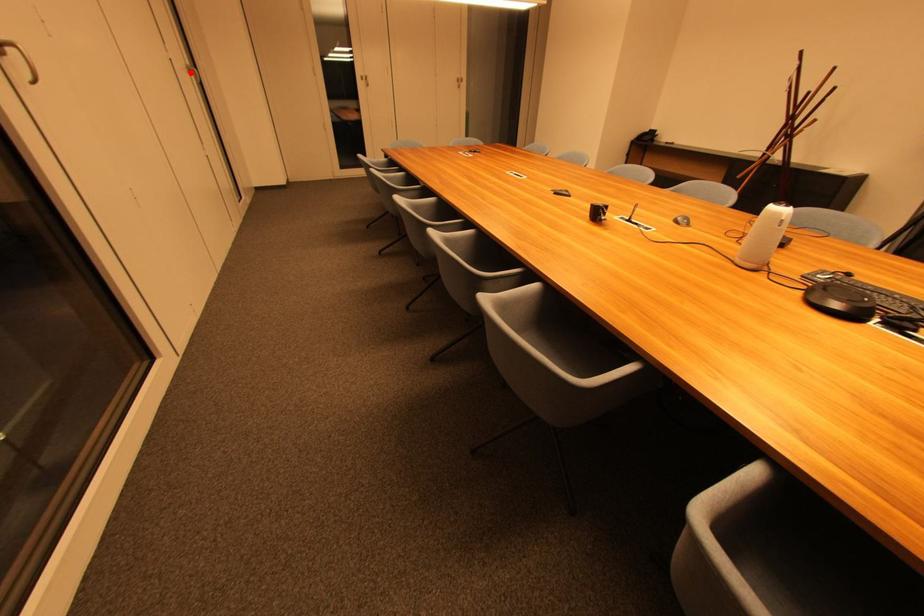
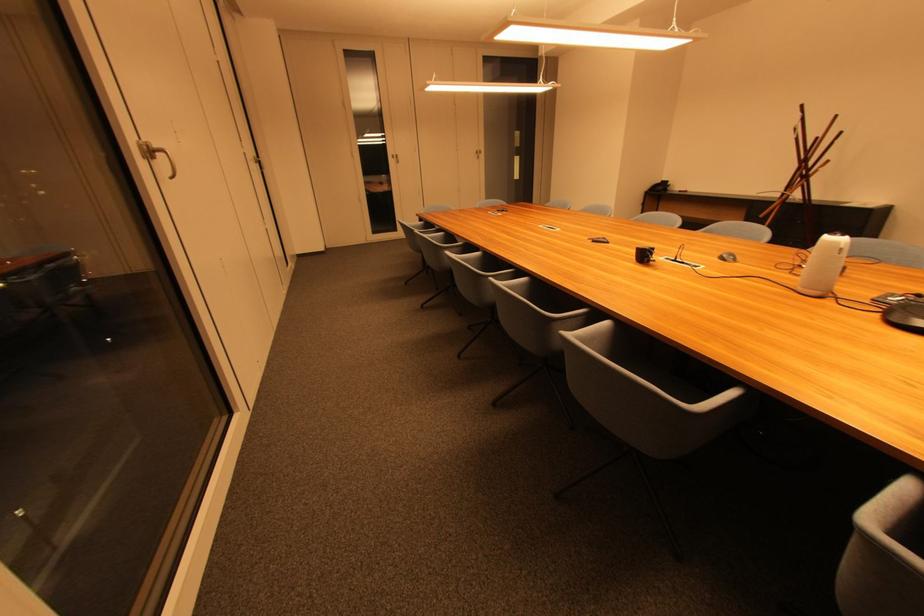
Question: I am providing you with two images of the same scene from different viewpoints. Image1 has a red point marked. In image2, the corresponding 3D location appears at what relative position? Reply with the corresponding letter.

Choices:
 (A) Closer
 (B) Farther

Answer: (A)